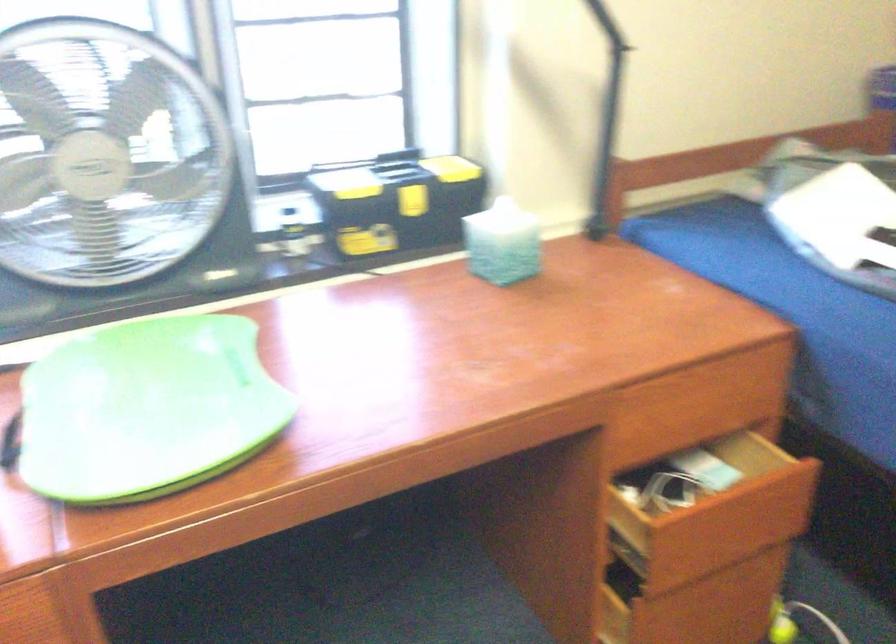
Identify the location of closed drawer front. (693, 415).